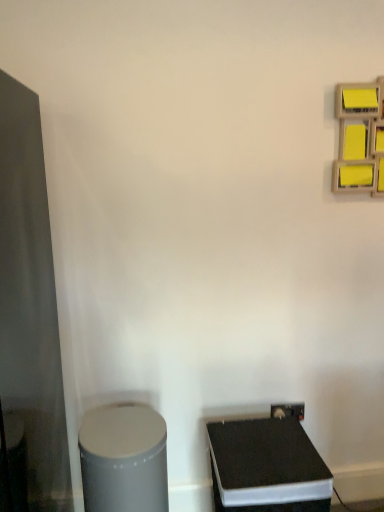
Question: Is black matte speaker at lower right, which appears as the first wide when viewed from the right, placed right next to matte black glass door at left?

Choices:
 (A) yes
 (B) no

Answer: (B)

Question: Is black matte speaker at lower right, which is the second wide from left to right, shorter than matte black glass door at left?

Choices:
 (A) yes
 (B) no

Answer: (A)

Question: Considering the relative sizes of black matte speaker at lower right, which is the second wide from left to right, and matte black glass door at left in the image provided, is black matte speaker at lower right, which is the second wide from left to right, taller than matte black glass door at left?

Choices:
 (A) yes
 (B) no

Answer: (B)

Question: Is black matte speaker at lower right, which appears as the first wide when viewed from the right, to the left of matte black glass door at left from the viewer's perspective?

Choices:
 (A) no
 (B) yes

Answer: (A)

Question: Is black matte speaker at lower right, which appears as the first wide when viewed from the right, positioned beyond the bounds of matte black glass door at left?

Choices:
 (A) no
 (B) yes

Answer: (B)

Question: From a real-world perspective, is black matte speaker at lower right, which is the second wide from left to right, positioned under matte black glass door at left based on gravity?

Choices:
 (A) yes
 (B) no

Answer: (A)

Question: Is yellow matte sticky notes at upper right a part of black matte speaker at lower right, which is the second wide from left to right?

Choices:
 (A) no
 (B) yes

Answer: (A)

Question: From a real-world perspective, is black matte speaker at lower right, which appears as the first wide when viewed from the right, on yellow matte sticky notes at upper right?

Choices:
 (A) no
 (B) yes

Answer: (A)

Question: Are black matte speaker at lower right, which appears as the first wide when viewed from the right, and yellow matte sticky notes at upper right located far from each other?

Choices:
 (A) no
 (B) yes

Answer: (B)

Question: From the image's perspective, is black matte speaker at lower right, which appears as the first wide when viewed from the right, above yellow matte sticky notes at upper right?

Choices:
 (A) yes
 (B) no

Answer: (B)

Question: Is yellow matte sticky notes at upper right at the back of black matte speaker at lower right, which appears as the first wide when viewed from the right?

Choices:
 (A) no
 (B) yes

Answer: (A)

Question: Does black matte speaker at lower right, which appears as the first wide when viewed from the right, turn towards yellow matte sticky notes at upper right?

Choices:
 (A) no
 (B) yes

Answer: (A)

Question: From a real-world perspective, is yellow matte sticky notes at upper right on black matte speaker at lower right, which appears as the first wide when viewed from the right?

Choices:
 (A) no
 (B) yes

Answer: (B)